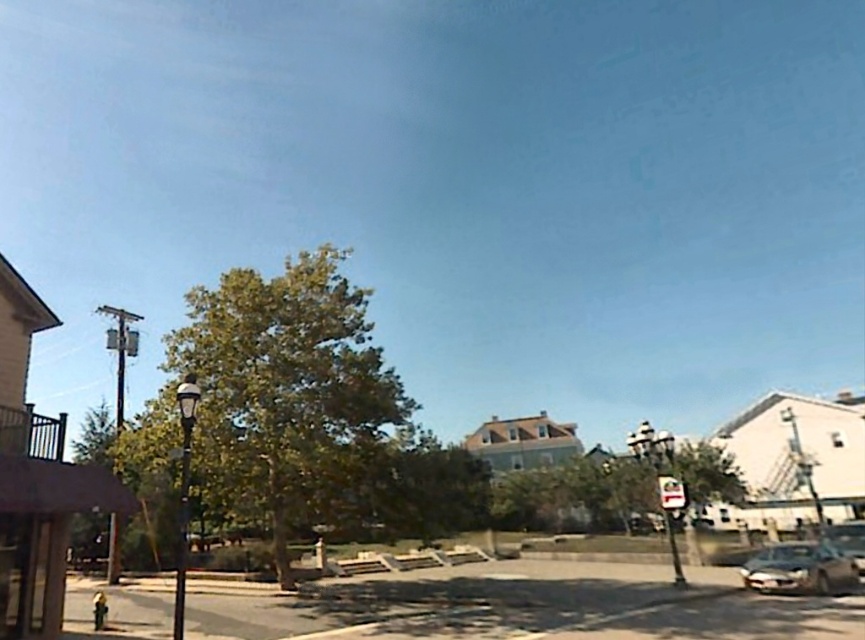
Question: Which object is farther from the camera taking this photo?

Choices:
 (A) white plastic street sign at center
 (B) shiny silver car at lower right

Answer: (A)

Question: Is shiny silver car at lower right above white plastic street sign at center?

Choices:
 (A) no
 (B) yes

Answer: (A)

Question: Is shiny silver car at lower right positioned at the back of white plastic street sign at center?

Choices:
 (A) no
 (B) yes

Answer: (A)

Question: Is shiny silver car at lower right to the right of white plastic street sign at center from the viewer's perspective?

Choices:
 (A) no
 (B) yes

Answer: (B)